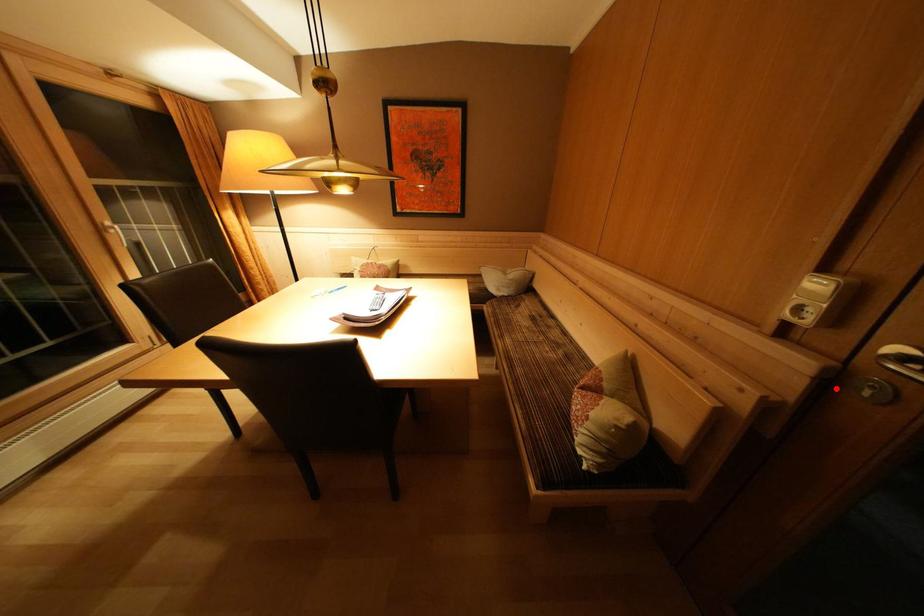
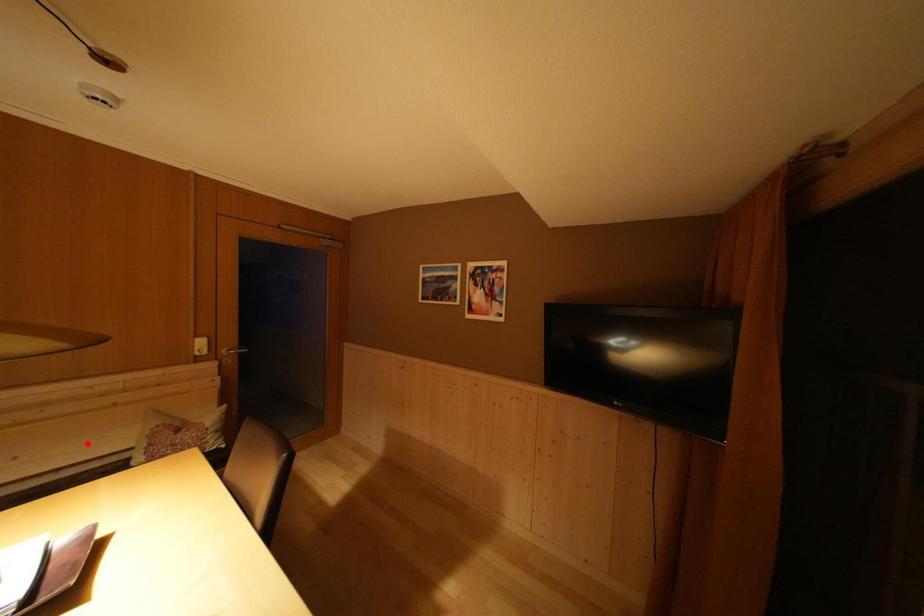
I am providing you with two images of the same scene from different viewpoints. A red point is marked on the first image and another point is marked on the second image. Are the points marked in image1 and image2 representing the same 3D position?

No